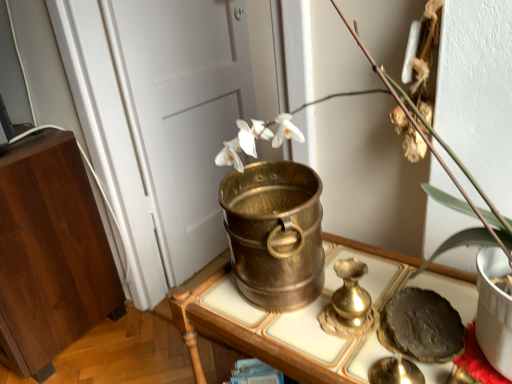
This screenshot has width=512, height=384. What do you see at coordinates (426, 147) in the screenshot?
I see `white porcelain vase at center` at bounding box center [426, 147].

Measure the distance between point (434, 155) and camera.

They are 24.02 inches apart.

Locate an element on the screen. This screenshot has width=512, height=384. brass bucket at center, the second furniture positioned from the left is located at coordinates pyautogui.click(x=262, y=349).

Considering the sizes of objects white porcelain vase at center and shiny dark plate at lower right in the image provided, who is thinner, white porcelain vase at center or shiny dark plate at lower right?

With smaller width is shiny dark plate at lower right.

Considering the positions of points (332, 2) and (416, 294), is point (332, 2) farther from camera compared to point (416, 294)?

Yes, point (332, 2) is farther from viewer.

Considering the relative sizes of white porcelain vase at center and shiny dark plate at lower right in the image provided, is white porcelain vase at center taller than shiny dark plate at lower right?

Indeed, white porcelain vase at center has a greater height compared to shiny dark plate at lower right.

How much distance is there between wooden cabinet at left, the first furniture when ordered from back to front, and shiny dark plate at lower right?

3.72 feet.

Is wooden cabinet at left, the 1th furniture from the left, aimed at shiny dark plate at lower right?

No, wooden cabinet at left, the 1th furniture from the left, does not turn towards shiny dark plate at lower right.

Consider the image. Is wooden cabinet at left, positioned as the second furniture in right-to-left order, next to shiny dark plate at lower right and touching it?

No, wooden cabinet at left, positioned as the second furniture in right-to-left order, is not with shiny dark plate at lower right.

Consider the image. What's the angular difference between wooden cabinet at left, positioned as the second furniture in right-to-left order, and shiny dark plate at lower right's facing directions?

The facing directions of wooden cabinet at left, positioned as the second furniture in right-to-left order, and shiny dark plate at lower right are 22.5 degrees apart.

From a real-world perspective, is brass bucket at center, the first furniture when ordered from front to back, physically below white matte door at center?

Correct, in the physical world, brass bucket at center, the first furniture when ordered from front to back, is lower than white matte door at center.

Would you say brass bucket at center, the second furniture positioned from the left, is outside white matte door at center?

That's correct, brass bucket at center, the second furniture positioned from the left, is outside of white matte door at center.

Which is closer to the camera, (x=470, y=281) or (x=232, y=58)?

The point (x=470, y=281) is closer.

Can you confirm if brass bucket at center, marked as the 2th furniture in a back-to-front arrangement, is wider than white matte door at center?

Yes.

How many degrees apart are the facing directions of brass bucket at center, which is the 1th furniture from right to left, and shiny dark plate at lower right?

brass bucket at center, which is the 1th furniture from right to left, and shiny dark plate at lower right are facing 26.9 degrees away from each other.

You are a GUI agent. You are given a task and a screenshot of the screen. Output one action in this format:
    pyautogui.click(x=<x>, y=<y>)
    Task: Click on the food that is above the brass bucket at center, the first furniture when ordered from front to back (from the image's perspective)
    The image size is (512, 384).
    Given the screenshot: What is the action you would take?
    pyautogui.click(x=421, y=326)

Is point (332, 377) in front of point (379, 331)?

Yes, point (332, 377) is closer to viewer.

Relative to shiny dark plate at lower right, is brass bucket at center, the second furniture positioned from the left, in front or behind?

Clearly, brass bucket at center, the second furniture positioned from the left, is in front of shiny dark plate at lower right.

Is white matte door at center directly adjacent to brass bucket at center, which is the 1th furniture from right to left?

No, white matte door at center is not making contact with brass bucket at center, which is the 1th furniture from right to left.

Considering the relative sizes of white matte door at center and brass bucket at center, the first furniture when ordered from front to back, in the image provided, is white matte door at center wider than brass bucket at center, the first furniture when ordered from front to back,?

In fact, white matte door at center might be narrower than brass bucket at center, the first furniture when ordered from front to back.

From the picture: Considering the positions of objects white matte door at center and brass bucket at center, the second furniture positioned from the left, in the image provided, who is in front, white matte door at center or brass bucket at center, the second furniture positioned from the left,?

Positioned in front is brass bucket at center, the second furniture positioned from the left.

Based on the photo, how different are the orientations of white matte door at center and brass bucket at center, marked as the 2th furniture in a back-to-front arrangement, in degrees?

They differ by 92.5 degrees in their facing directions.

Which of these two, white porcelain vase at center or wooden cabinet at left, the 1th furniture from the left, stands taller?

wooden cabinet at left, the 1th furniture from the left.

Which of these two, white porcelain vase at center or wooden cabinet at left, the 1th furniture from the left, is wider?

wooden cabinet at left, the 1th furniture from the left.

From a real-world perspective, is white porcelain vase at center located higher than wooden cabinet at left, positioned as the second furniture in right-to-left order?

Correct, in the physical world, white porcelain vase at center is higher than wooden cabinet at left, positioned as the second furniture in right-to-left order.

Is white porcelain vase at center smaller than wooden cabinet at left, positioned as the second furniture in right-to-left order?

Indeed, white porcelain vase at center has a smaller size compared to wooden cabinet at left, positioned as the second furniture in right-to-left order.

Consider the image. From a real-world perspective, between white porcelain vase at center and brass bucket at center, which is the 1th furniture from right to left, who is vertically lower?

brass bucket at center, which is the 1th furniture from right to left.

Between white porcelain vase at center and brass bucket at center, the first furniture when ordered from front to back, which one has smaller width?

white porcelain vase at center.

Considering the relative sizes of white porcelain vase at center and brass bucket at center, the first furniture when ordered from front to back, in the image provided, is white porcelain vase at center bigger than brass bucket at center, the first furniture when ordered from front to back,?

Actually, white porcelain vase at center might be smaller than brass bucket at center, the first furniture when ordered from front to back.

Locate an element on the screen. the 1st furniture behind the white porcelain vase at center, counting from the anchor's position is located at coordinates (262, 349).

Find the location of a particular element. houseplant in front of the shiny dark plate at lower right is located at coordinates [426, 147].

Locate an element on the screen. The height and width of the screenshot is (384, 512). food below the wooden cabinet at left, the second furniture from the front (from the image's perspective) is located at coordinates (421, 326).

Which object lies nearer to the anchor point wooden cabinet at left, the first furniture when ordered from back to front, white matte door at center or white porcelain vase at center?

Based on the image, white matte door at center appears to be nearer to wooden cabinet at left, the first furniture when ordered from back to front.

Estimate the real-world distances between objects in this image. Which object is further from white matte door at center, shiny dark plate at lower right or brass bucket at center, which is the 1th furniture from right to left?

Based on the image, shiny dark plate at lower right appears to be further to white matte door at center.

Based on their spatial positions, is shiny dark plate at lower right or brass bucket at center, marked as the 2th furniture in a back-to-front arrangement, further from wooden cabinet at left, positioned as the second furniture in right-to-left order?

Among the two, shiny dark plate at lower right is located further to wooden cabinet at left, positioned as the second furniture in right-to-left order.

From the image, which object appears to be nearer to white matte door at center, brass bucket at center, which is the 1th furniture from right to left, or shiny dark plate at lower right?

Among the two, brass bucket at center, which is the 1th furniture from right to left, is located nearer to white matte door at center.

Looking at this image, which object lies nearer to the anchor point white porcelain vase at center, shiny dark plate at lower right or brass bucket at center, the second furniture positioned from the left?

shiny dark plate at lower right lies closer to white porcelain vase at center than the other object.

When comparing their distances from wooden cabinet at left, the first furniture when ordered from back to front, does white porcelain vase at center or brass bucket at center, marked as the 2th furniture in a back-to-front arrangement, seem further?

white porcelain vase at center is further to wooden cabinet at left, the first furniture when ordered from back to front.

Based on the photo, estimate the real-world distances between objects in this image. Which object is closer to brass bucket at center, the second furniture positioned from the left, shiny dark plate at lower right or white porcelain vase at center?

shiny dark plate at lower right is positioned closer to the anchor brass bucket at center, the second furniture positioned from the left.

Based on their spatial positions, is shiny dark plate at lower right or white porcelain vase at center further from white matte door at center?

shiny dark plate at lower right is positioned further to the anchor white matte door at center.

At what (x,y) coordinates should I click in order to perform the action: click on door between wooden cabinet at left, the 1th furniture from the left, and white porcelain vase at center from left to right. Please return your answer as a coordinate pair (x, y). This screenshot has width=512, height=384. Looking at the image, I should click on (183, 112).

You are a GUI agent. You are given a task and a screenshot of the screen. Output one action in this format:
    pyautogui.click(x=<x>, y=<y>)
    Task: Click on the food between brass bucket at center, which is the 1th furniture from right to left, and white matte door at center from front to back
    The height and width of the screenshot is (384, 512).
    Given the screenshot: What is the action you would take?
    pyautogui.click(x=421, y=326)

At what (x,y) coordinates should I click in order to perform the action: click on door located between wooden cabinet at left, the first furniture when ordered from back to front, and brass bucket at center, the first furniture when ordered from front to back, in the left-right direction. Please return your answer as a coordinate pair (x, y). This screenshot has height=384, width=512. Looking at the image, I should click on (183, 112).

At what (x,y) coordinates should I click in order to perform the action: click on food between white porcelain vase at center and white matte door at center in the front-back direction. Please return your answer as a coordinate pair (x, y). The image size is (512, 384). Looking at the image, I should click on (421, 326).